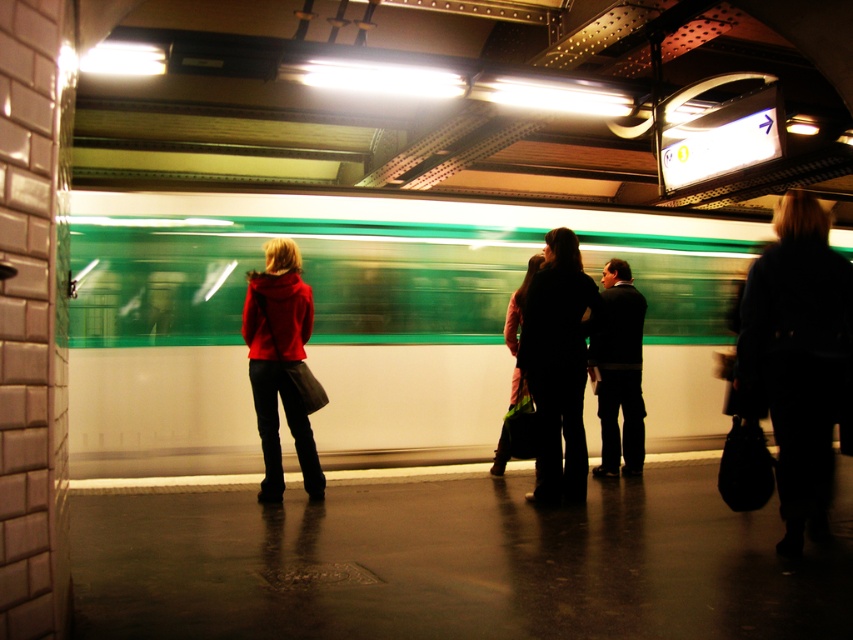
Is matte red jacket at left smaller than matte black coat at center?

Yes.

Does matte red jacket at left appear over matte black coat at center?

Incorrect, matte red jacket at left is not positioned above matte black coat at center.

Is point (267, 362) less distant than point (518, 300)?

Yes, it is in front of point (518, 300).

Locate an element on the screen. The image size is (853, 640). matte red jacket at left is located at coordinates (279, 364).

Between point (195, 241) and point (521, 289), which one is positioned in front?

Positioned in front is point (521, 289).

Which is below, green glossy train at center or matte black coat at center?

matte black coat at center

Is point (399, 300) less distant than point (508, 444)?

No, (399, 300) is further to viewer.

Where is `green glossy train at center`? The image size is (853, 640). green glossy train at center is located at coordinates (360, 323).

Between green glossy train at center and dark blue coat at right, which one has less height?

With less height is green glossy train at center.

Is green glossy train at center to the left of dark blue coat at right from the viewer's perspective?

Correct, you'll find green glossy train at center to the left of dark blue coat at right.

Find the location of a particular element. green glossy train at center is located at coordinates (360, 323).